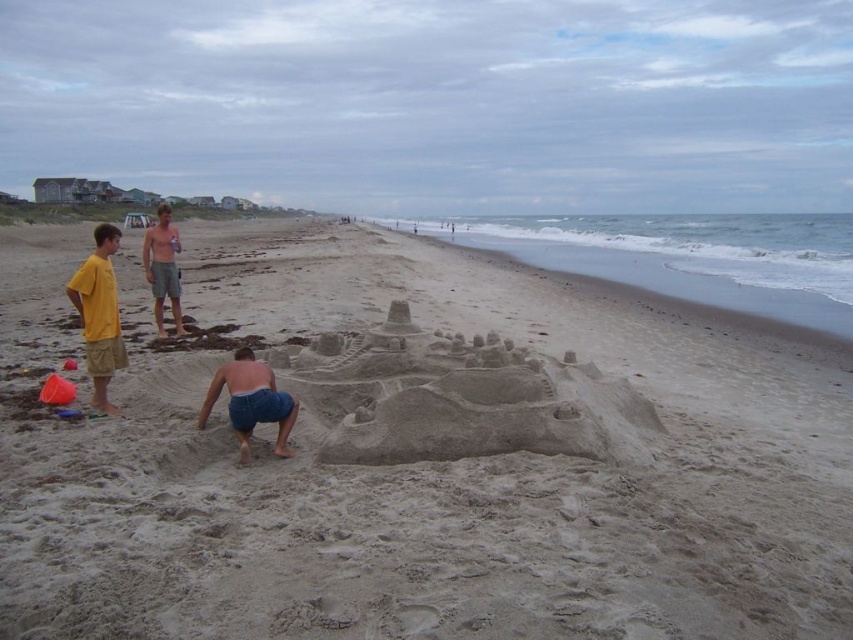
Find the location of `smooth sandcastle at center`. smooth sandcastle at center is located at coordinates click(x=422, y=460).

The width and height of the screenshot is (853, 640). What are the coordinates of `smooth sandcastle at center` in the screenshot? It's located at (422, 460).

Is yellow cotton shirt at left to the right of shiny metallic can at center from the viewer's perspective?

No, yellow cotton shirt at left is not to the right of shiny metallic can at center.

Between yellow cotton shirt at left and shiny metallic can at center, which one appears on the left side from the viewer's perspective?

From the viewer's perspective, yellow cotton shirt at left appears more on the left side.

Who is more distant from viewer, (86, 298) or (160, 294)?

The point (160, 294) is behind.

Where is `yellow cotton shirt at left`? yellow cotton shirt at left is located at coordinates (99, 314).

Is smooth sandcastle at center to the left of yellow cotton shirt at left from the viewer's perspective?

No, smooth sandcastle at center is not to the left of yellow cotton shirt at left.

Between point (97, 445) and point (109, 237), which one is positioned behind?

The point (109, 237) is behind.

I want to click on smooth sandcastle at center, so click(422, 460).